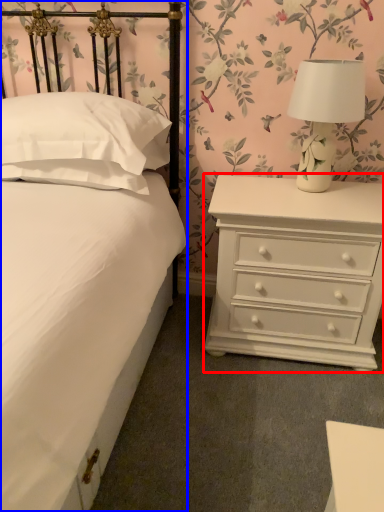
Question: Which point is further to the camera, chest of drawers (highlighted by a red box) or bed (highlighted by a blue box)?

Choices:
 (A) chest of drawers
 (B) bed

Answer: (A)